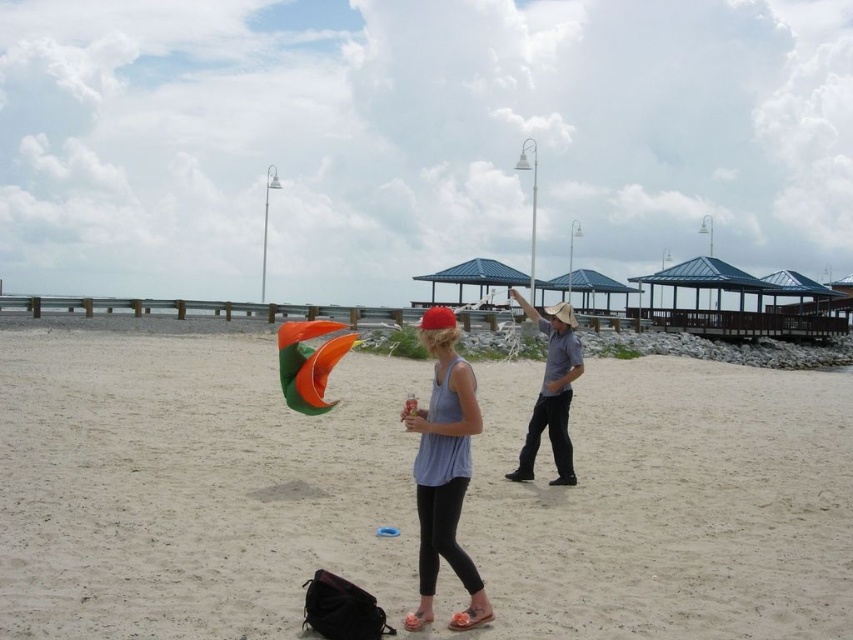
You are standing on the beach and see two points in the scene. The first point is at coordinates point (563, 468) and the second point is at point (312, 353). Which point is closer to you?

Point (563, 468) is closer to the viewer than point (312, 353).

You are a fashion designer observing two people at the beach. You notice the matte blue tank top at center and the gray cotton shirt at center. Which clothing item has a shorter length?

The matte blue tank top at center is shorter than the gray cotton shirt at center.